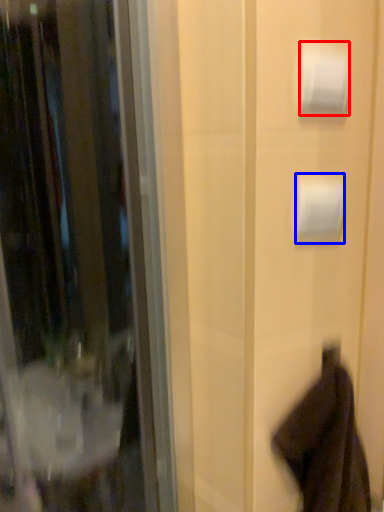
Question: Which of the following is the farthest to the observer, toilet paper (highlighted by a red box) or toilet paper (highlighted by a blue box)?

Choices:
 (A) toilet paper
 (B) toilet paper

Answer: (B)